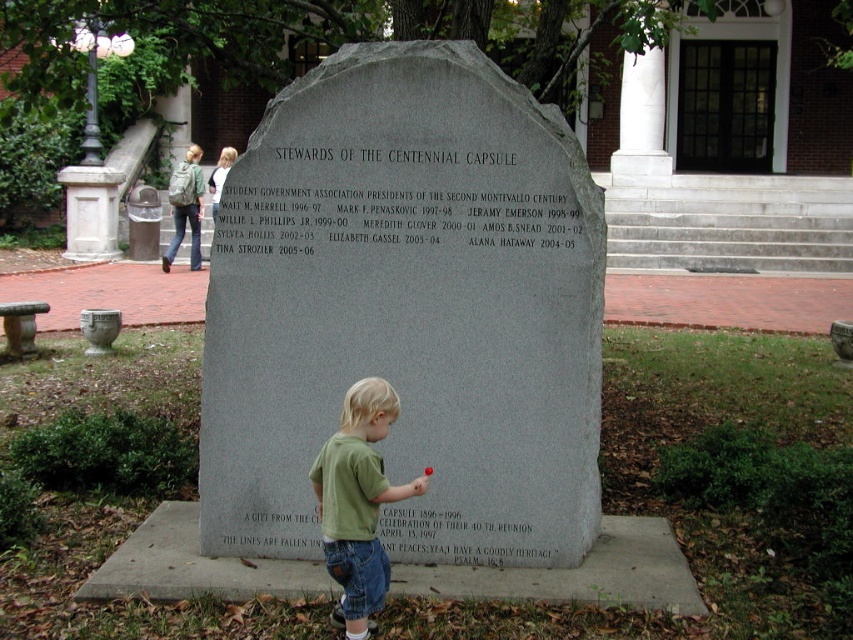
Question: Where is green cotton shirt at center located in relation to matte gray stone at lower center in the image?

Choices:
 (A) below
 (B) above

Answer: (B)

Question: Does gray stone monument at center appear over matte gray stone at lower center?

Choices:
 (A) no
 (B) yes

Answer: (B)

Question: Which of the following is the closest to the observer?

Choices:
 (A) gray stone plaque at center
 (B) gray stone monument at center
 (C) matte gray stone at lower center

Answer: (B)

Question: Which point is closer to the camera?

Choices:
 (A) (339, 205)
 (B) (596, 490)
 (C) (234, 531)

Answer: (A)

Question: Which object is farther from the camera taking this photo?

Choices:
 (A) green cotton shirt at center
 (B) matte gray stone at lower center
 (C) gray stone monument at center
 (D) gray stone plaque at center

Answer: (B)

Question: Can you confirm if gray stone plaque at center is thinner than green cotton shirt at center?

Choices:
 (A) yes
 (B) no

Answer: (B)